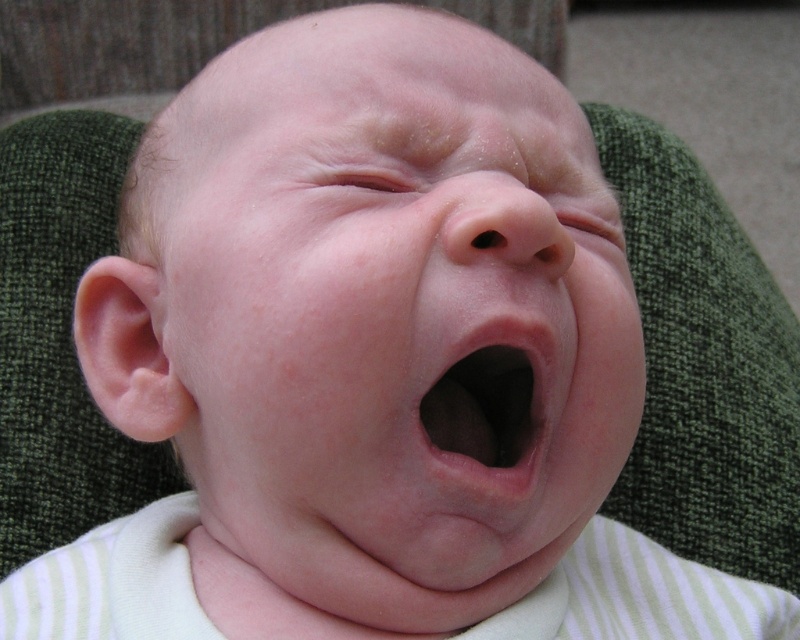
Based on the scene described, where is the pink smooth skin at center located in terms of coordinates?

The pink smooth skin at center is located at coordinates point (394, 312).

You are holding a baby and notice a point on their cheek at coordinates point (556, 458). You want to apply a small bandage that is 2 centimeters in diameter. Is the distance between you and the baby sufficient to safely apply the bandage without touching other areas?

The distance between you and the baby at point (556, 458) is 47.32 centimeters. Since the bandage is only 2 centimeters in diameter, the distance is more than enough to safely apply it without touching other areas.